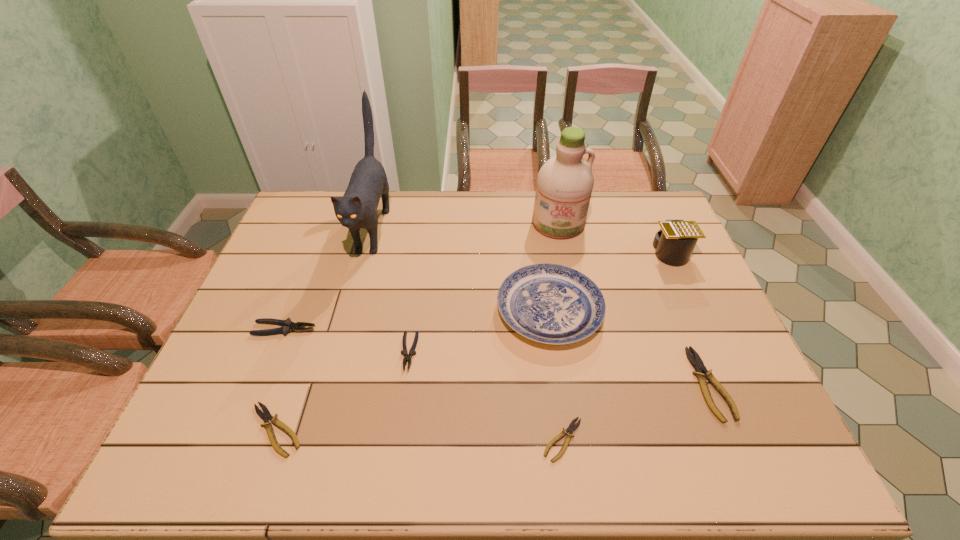
Where is `cat`? cat is located at coordinates [357, 208].

Where is `cleansing agent`? cleansing agent is located at coordinates (565, 182).

Identify the location of the third tallest object. This screenshot has height=540, width=960. (674, 243).

The image size is (960, 540). I want to click on plate, so click(549, 303).

Identify the location of blue plate. (549, 303).

This screenshot has width=960, height=540. Identify the location of the left gray pliers. (287, 325).

Where is `the bigger gray pliers`? The width and height of the screenshot is (960, 540). the bigger gray pliers is located at coordinates (287, 325).

This screenshot has width=960, height=540. I want to click on the rightmost yellow pliers, so click(x=702, y=373).

This screenshot has width=960, height=540. What are the coordinates of `the rightmost pliers` in the screenshot? It's located at (702, 373).

At what (x,y) coordinates should I click in order to perform the action: click on the third pliers from left to right. Please return your answer as a coordinate pair (x, y). This screenshot has width=960, height=540. Looking at the image, I should click on (407, 357).